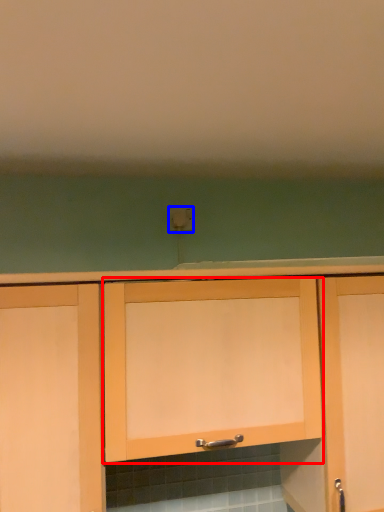
Question: Among these objects, which one is farthest to the camera, cabinetry (highlighted by a red box) or electric outlet (highlighted by a blue box)?

Choices:
 (A) cabinetry
 (B) electric outlet

Answer: (B)